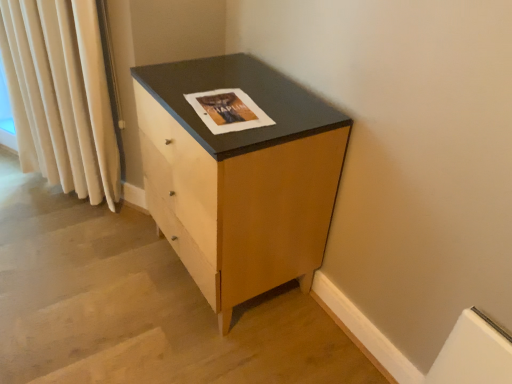
At what (x,y) coordinates should I click in order to perform the action: click on empty space that is to the right of matte paper magazine at center. Please return your answer as a coordinate pair (x, y). This screenshot has width=512, height=384. Looking at the image, I should click on (294, 108).